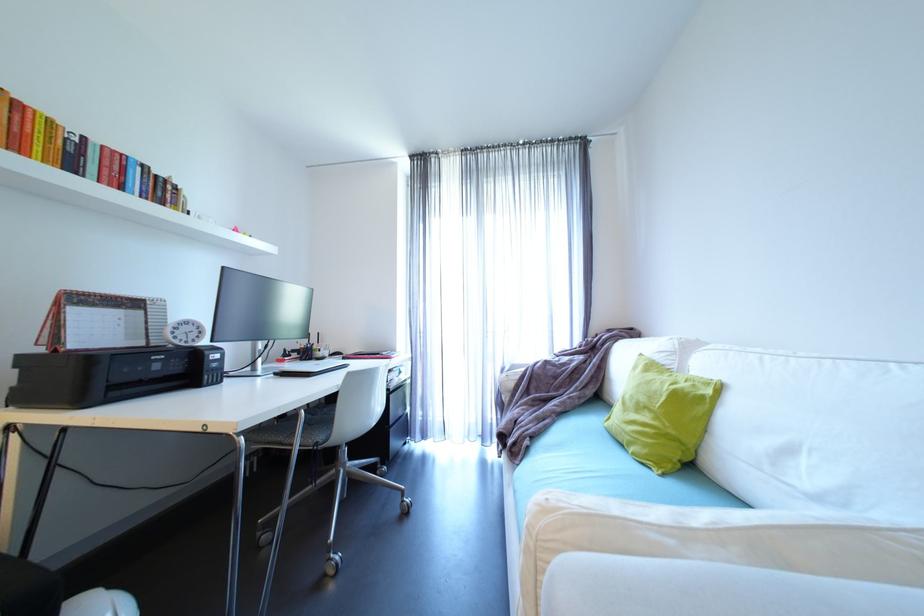
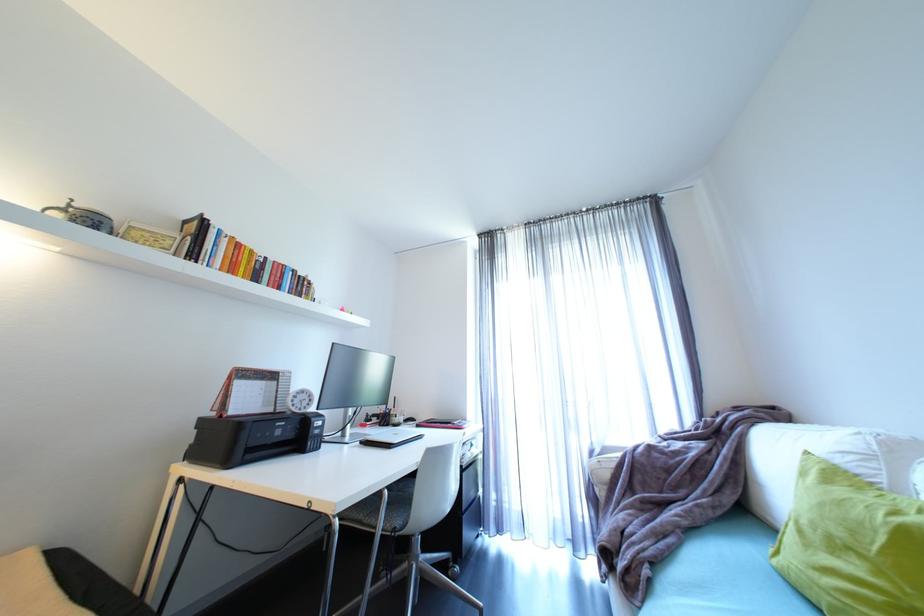
Find the pixel in the second image that matches point (385, 354) in the first image.

(457, 424)